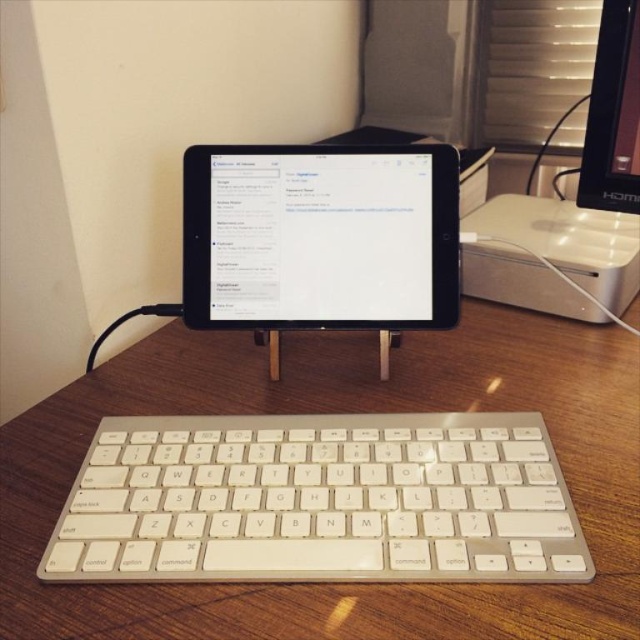
Can you confirm if white plastic keyboard at center is thinner than black glossy monitor at upper right?

Incorrect, white plastic keyboard at center's width is not less than black glossy monitor at upper right's.

Is point (356, 538) closer to camera compared to point (612, 108)?

Yes.

Who is more forward, (339, 516) or (634, 115)?

Positioned in front is point (339, 516).

Where is `white plastic keyboard at center`? The height and width of the screenshot is (640, 640). white plastic keyboard at center is located at coordinates (320, 500).

Between wooden table at center and black glossy tablet at center, which one appears on the right side from the viewer's perspective?

wooden table at center is more to the right.

I want to click on wooden table at center, so click(330, 410).

At what (x,y) coordinates should I click in order to perform the action: click on wooden table at center. Please return your answer as a coordinate pair (x, y). Looking at the image, I should click on (330, 410).

Does white plastic keyboard at center have a greater height compared to white plastic desktop computer at upper right?

In fact, white plastic keyboard at center may be shorter than white plastic desktop computer at upper right.

Can you confirm if white plastic keyboard at center is positioned to the right of white plastic desktop computer at upper right?

No, white plastic keyboard at center is not to the right of white plastic desktop computer at upper right.

Who is more forward, [296,563] or [513,264]?

Point [296,563]

Where is `white plastic keyboard at center`? white plastic keyboard at center is located at coordinates (320, 500).